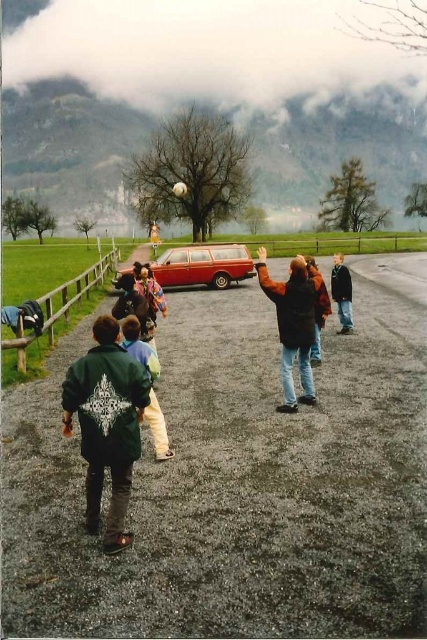
Which is below, brown leather jacket at center or shiny red station wagon at center?

brown leather jacket at center is lower down.

Who is positioned more to the left, brown leather jacket at center or shiny red station wagon at center?

Positioned to the left is shiny red station wagon at center.

Locate an element on the screen. Image resolution: width=427 pixels, height=640 pixels. brown leather jacket at center is located at coordinates (292, 323).

Where is `brown leather jacket at center`? The image size is (427, 640). brown leather jacket at center is located at coordinates (292, 323).

Can you confirm if green fuzzy jacket at lower left is smaller than shiny red station wagon at center?

Indeed, green fuzzy jacket at lower left has a smaller size compared to shiny red station wagon at center.

Can you confirm if green fuzzy jacket at lower left is shorter than shiny red station wagon at center?

In fact, green fuzzy jacket at lower left may be taller than shiny red station wagon at center.

What do you see at coordinates (107, 424) in the screenshot? This screenshot has height=640, width=427. I see `green fuzzy jacket at lower left` at bounding box center [107, 424].

Find the location of `green fuzzy jacket at lower left`. green fuzzy jacket at lower left is located at coordinates (107, 424).

Does point (274, 291) come behind point (158, 406)?

Yes, it is behind point (158, 406).

Can you confirm if brown leather jacket at center is thinner than green fleece jacket at lower left?

Incorrect, brown leather jacket at center's width is not less than green fleece jacket at lower left's.

The width and height of the screenshot is (427, 640). I want to click on brown leather jacket at center, so click(x=292, y=323).